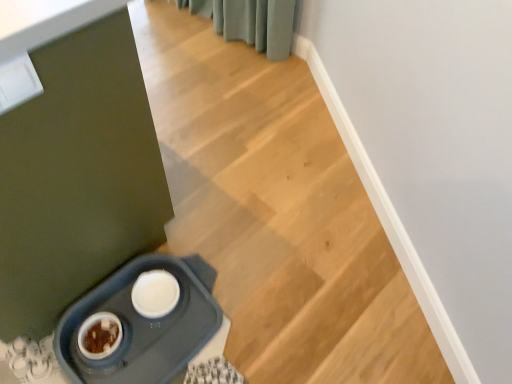
Where is `free region under matte plastic pet feeder at lower left (from a real-world perspective)`? This screenshot has width=512, height=384. free region under matte plastic pet feeder at lower left (from a real-world perspective) is located at coordinates (168, 336).